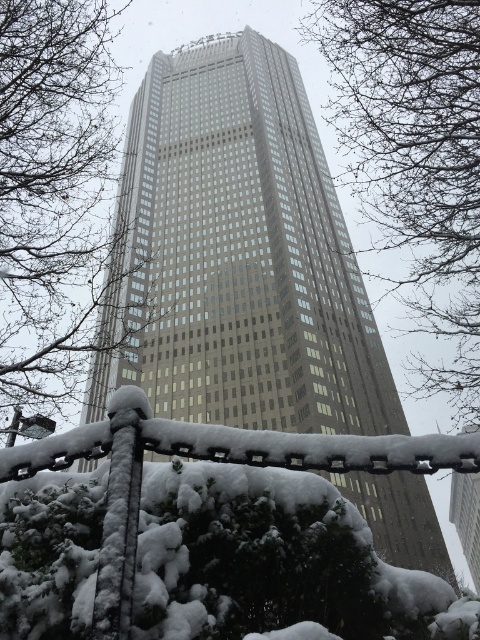
Question: Does snow-covered chain-link fence at lower center appear on the left side of bare branches at center?

Choices:
 (A) yes
 (B) no

Answer: (B)

Question: Which of the following is the farthest from the observer?

Choices:
 (A) bare branches at center
 (B) bare branches at upper center
 (C) snow-covered chain-link fence at lower center

Answer: (A)

Question: Does gray glass skyscraper at center have a smaller size compared to bare branches at center?

Choices:
 (A) yes
 (B) no

Answer: (A)

Question: Does gray glass skyscraper at center have a smaller size compared to bare branches at upper center?

Choices:
 (A) yes
 (B) no

Answer: (A)

Question: Which of the following is the farthest from the observer?

Choices:
 (A) snow-covered chain-link fence at lower center
 (B) bare branches at upper center
 (C) gray glass skyscraper at center

Answer: (C)

Question: Which object is the farthest from the bare branches at upper center?

Choices:
 (A) snow-covered chain-link fence at lower center
 (B) gray glass skyscraper at center

Answer: (A)